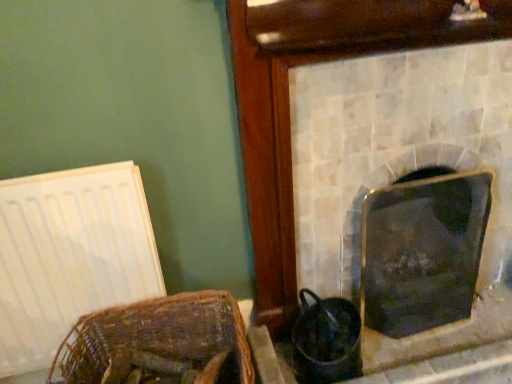
Question: From the image's perspective, is woven brown basket at lower left located above or below metallic silver fireplace at center, which is the 2th fireplace in right-to-left order?

Choices:
 (A) below
 (B) above

Answer: (A)

Question: From their relative heights in the image, would you say woven brown basket at lower left is taller or shorter than metallic silver fireplace at center, which is the 2th fireplace in right-to-left order?

Choices:
 (A) short
 (B) tall

Answer: (A)

Question: Estimate the real-world distances between objects in this image. Which object is closer to the woven brown basket at lower left?

Choices:
 (A) white matte radiator at left
 (B) metallic silver fireplace at center, acting as the 1th fireplace starting from the left
 (C) shiny black glass at right, the 1th fireplace viewed from the right

Answer: (A)

Question: Which of these objects is positioned farthest from the shiny black glass at right, the 1th fireplace viewed from the right?

Choices:
 (A) white matte radiator at left
 (B) woven brown basket at lower left
 (C) metallic silver fireplace at center, acting as the 1th fireplace starting from the left

Answer: (A)